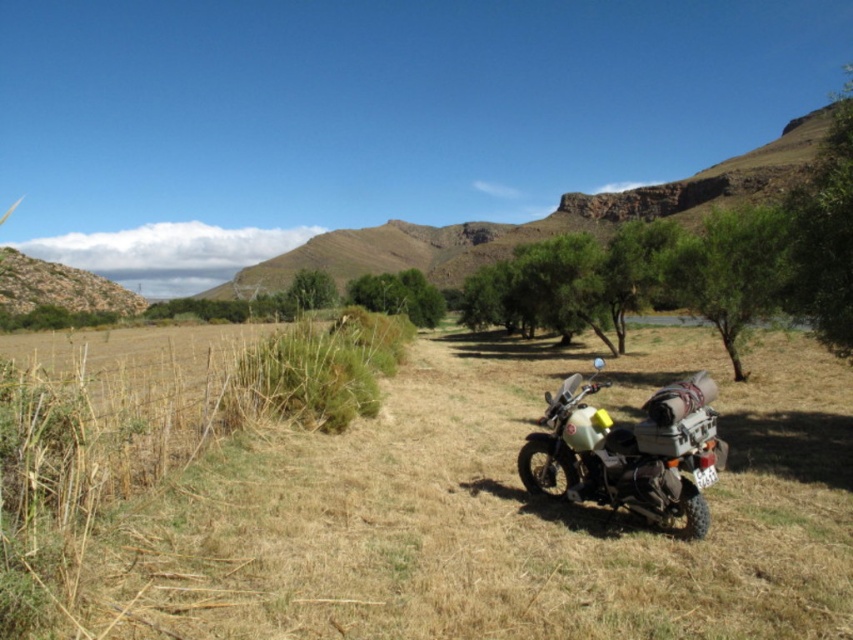
Is green leafy tree at upper right shorter than green leafy tree at center?

No, green leafy tree at upper right is not shorter than green leafy tree at center.

Between green leafy tree at upper right and green leafy tree at center, which one has less height?

With less height is green leafy tree at center.

The width and height of the screenshot is (853, 640). Describe the element at coordinates (824, 234) in the screenshot. I see `green leafy tree at upper right` at that location.

This screenshot has width=853, height=640. What are the coordinates of `green leafy tree at upper right` in the screenshot? It's located at (824, 234).

Can you confirm if dry grass at lower center is positioned above green leafy tree at center?

Incorrect, dry grass at lower center is not positioned above green leafy tree at center.

Who is more forward, [323,602] or [395,305]?

Point [323,602] is in front.

Locate an element on the screen. dry grass at lower center is located at coordinates (495, 515).

Which is in front, point (461, 564) or point (676, 492)?

Point (461, 564)

Does dry grass at lower center have a lesser height compared to matte black motorbike at center?

In fact, dry grass at lower center may be taller than matte black motorbike at center.

Describe the element at coordinates (495, 515) in the screenshot. The height and width of the screenshot is (640, 853). I see `dry grass at lower center` at that location.

Where is `dry grass at lower center`? dry grass at lower center is located at coordinates (495, 515).